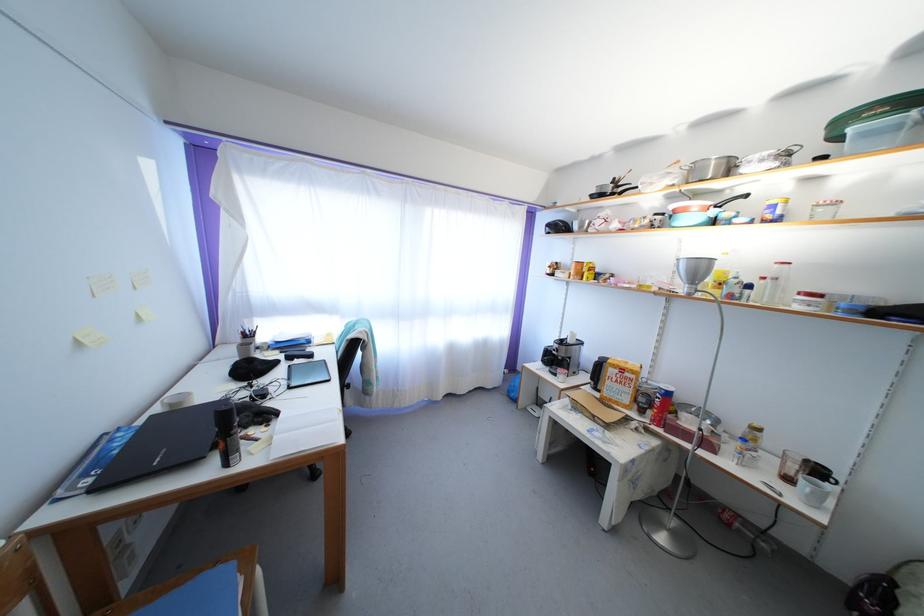
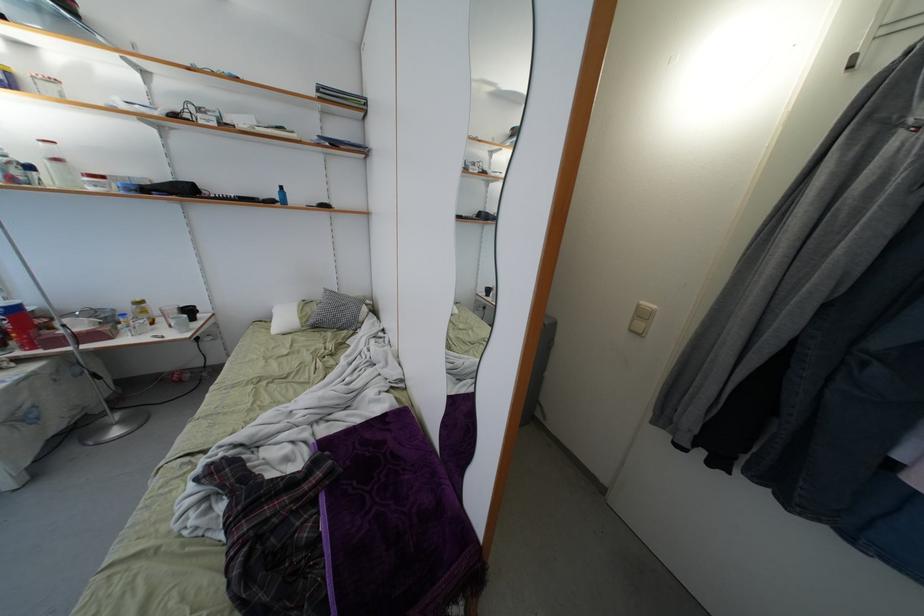
In the second image, find the point that corresponds to (x=663, y=410) in the first image.

(22, 333)